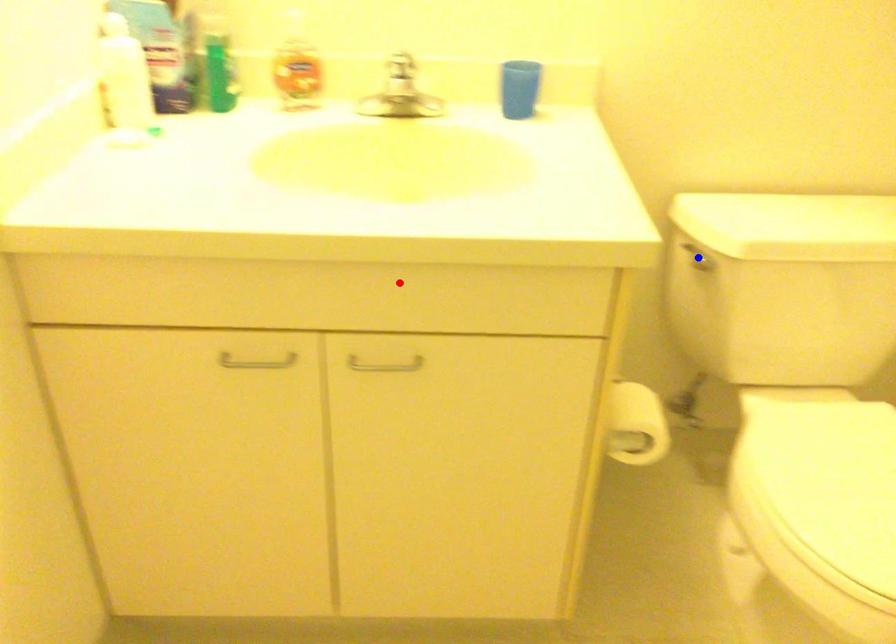
Question: Which of the two points in the image is closer to the camera?

Choices:
 (A) Blue point is closer.
 (B) Red point is closer.

Answer: (B)